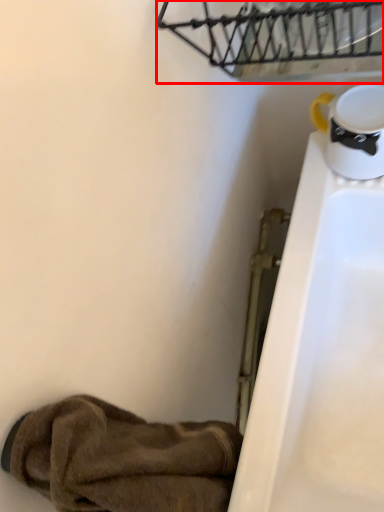
Question: From the image's perspective, where is basket (annotated by the red box) located in relation to footwear in the image?

Choices:
 (A) above
 (B) below

Answer: (A)